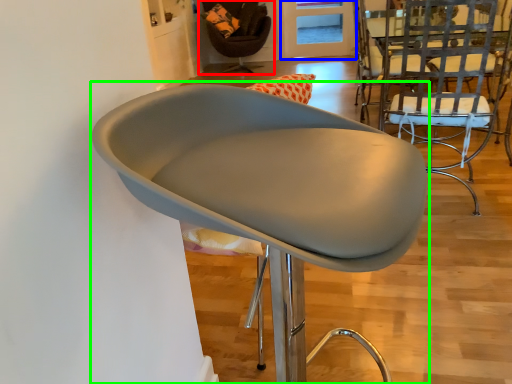
Question: Which object is the closest to the chair (highlighted by a red box)? Choose among these: glass door (highlighted by a blue box) or chair (highlighted by a green box).

Choices:
 (A) glass door
 (B) chair

Answer: (A)